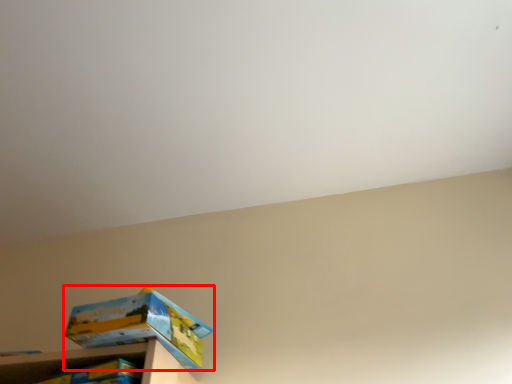
Question: Considering the relative positions of box (annotated by the red box) and shelf in the image provided, where is box (annotated by the red box) located with respect to the staircase?

Choices:
 (A) right
 (B) left

Answer: (A)